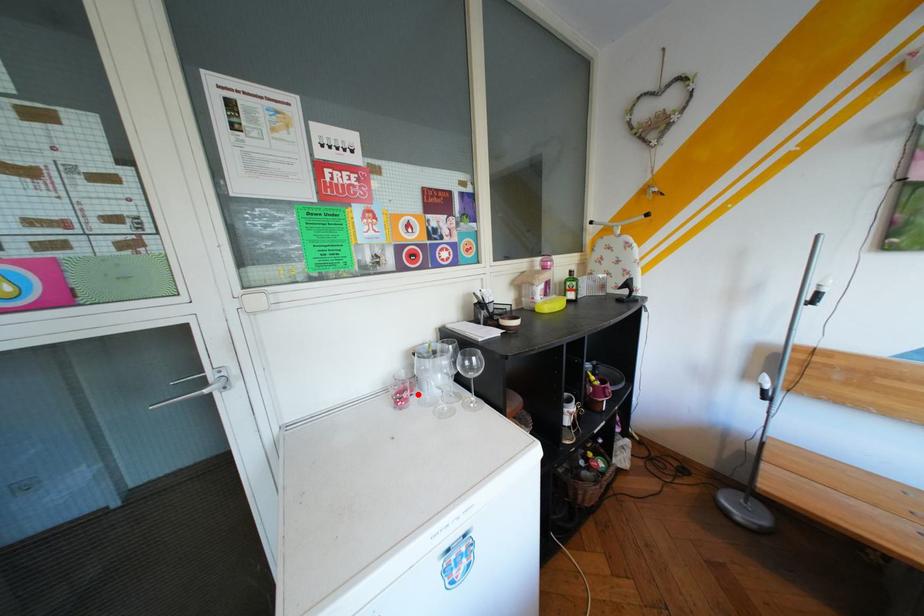
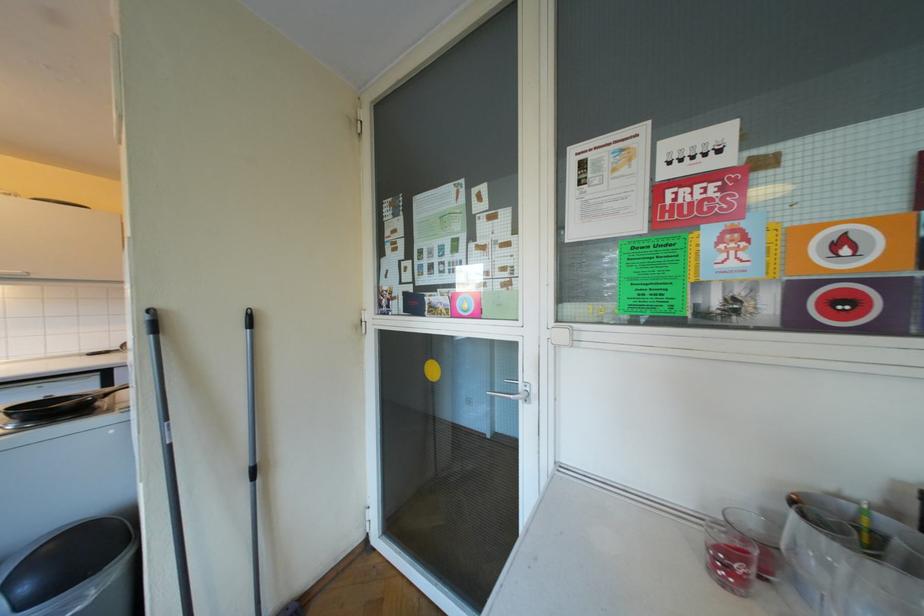
Locate, in the second image, the point that corresponds to the highlighted location in the first image.

(752, 567)